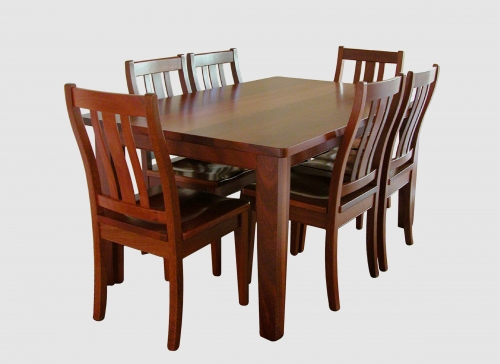
This screenshot has width=500, height=364. I want to click on seat, so click(x=201, y=219).